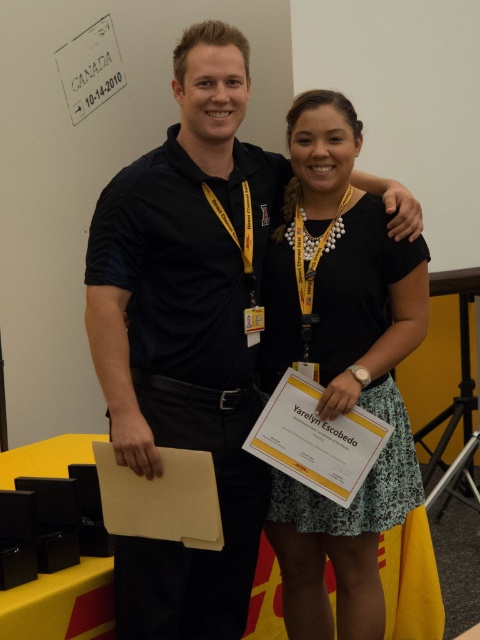
Question: Which point is closer to the camera?

Choices:
 (A) (156, 605)
 (B) (370, 243)

Answer: (A)

Question: Does black matte shirt at upper left have a smaller size compared to black floral dress at center?

Choices:
 (A) yes
 (B) no

Answer: (B)

Question: Is black matte shirt at upper left thinner than black floral dress at center?

Choices:
 (A) no
 (B) yes

Answer: (A)

Question: Which point is farther from the camera taking this photo?

Choices:
 (A) (250, 284)
 (B) (288, 256)

Answer: (B)

Question: Which of the following is the closest to the observer?

Choices:
 (A) black floral dress at center
 (B) black matte shirt at upper left

Answer: (B)

Question: Does black matte shirt at upper left come in front of black floral dress at center?

Choices:
 (A) yes
 (B) no

Answer: (A)